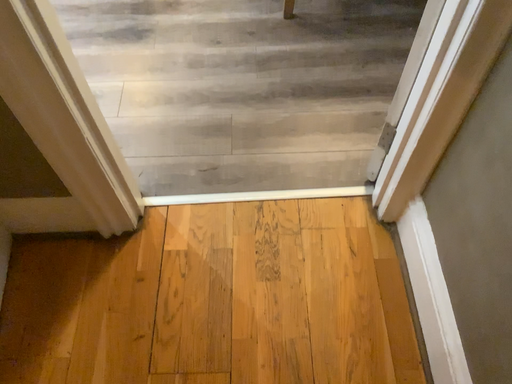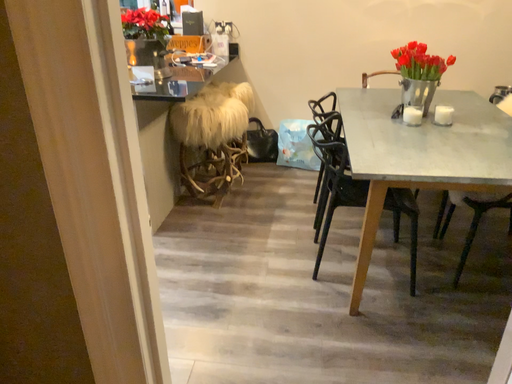
Question: Which way did the camera rotate in the video?

Choices:
 (A) rotated upward
 (B) rotated downward

Answer: (A)